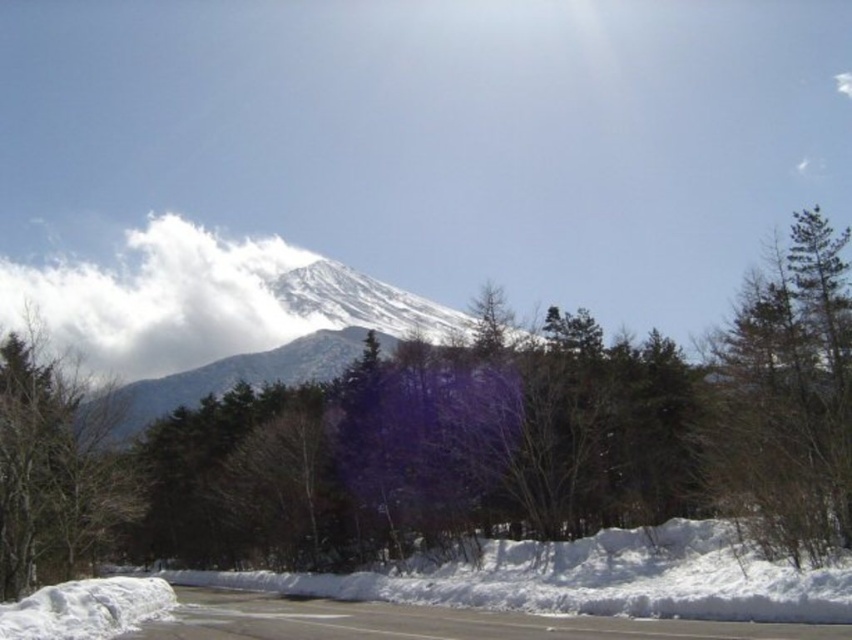
Question: Considering the real-world distances, which object is closest to the green matte tree at right?

Choices:
 (A) white fluffy cloud at upper center
 (B) green matte tree at left

Answer: (B)

Question: Can you confirm if green matte tree at left is positioned below white snow-covered mountain at center?

Choices:
 (A) yes
 (B) no

Answer: (A)

Question: Which of the following is the closest to the observer?

Choices:
 (A) (96, 358)
 (B) (1, 563)

Answer: (B)

Question: Which of the following is the closest to the observer?

Choices:
 (A) green matte tree at right
 (B) white fluffy cloud at upper center

Answer: (A)

Question: Does green matte tree at left appear on the left side of white snow-covered mountain at center?

Choices:
 (A) yes
 (B) no

Answer: (A)

Question: Is the position of green matte tree at right less distant than that of green matte tree at left?

Choices:
 (A) yes
 (B) no

Answer: (A)